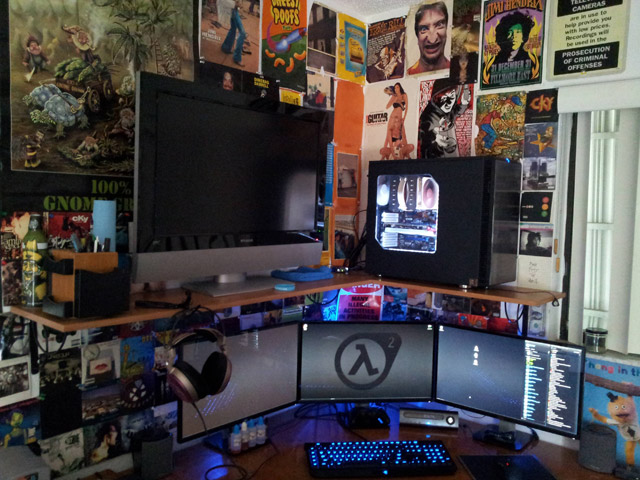
Image resolution: width=640 pixels, height=480 pixels. Identify the location of computer screens. (470, 362), (390, 367), (256, 380).